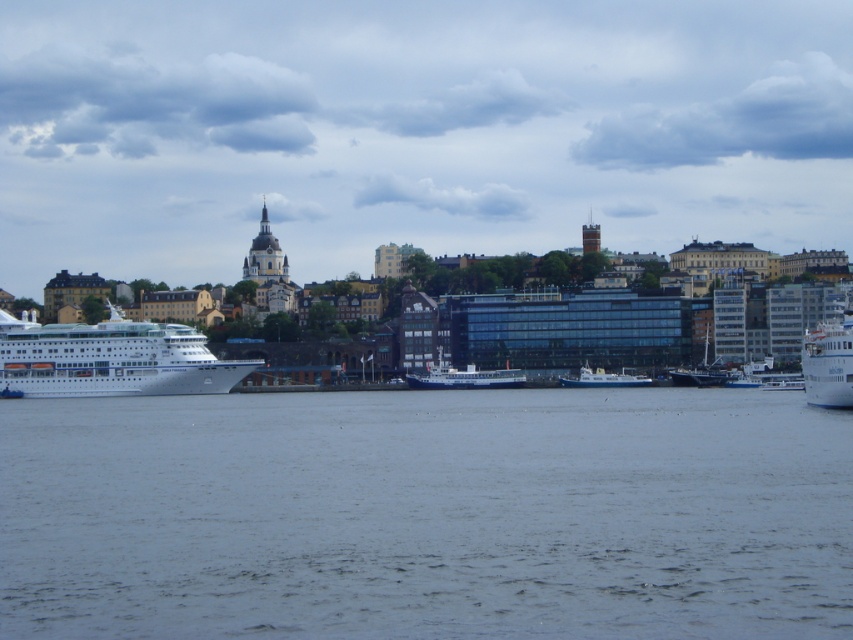
You are standing at the camera position and want to know how far the point marked at coordinates (706, 342) is from you. Can you determine the distance?

The point marked at coordinates (706, 342) is 186.01 meters away from the camera.

You are a dock worker who needs to park two boats side by side on a pier that can only accommodate a total width of 10 meters. The blue metallic boat at center and the white matte boat at center are both available. Given their widths, can both boats fit on the pier together?

The blue metallic boat at center has a lesser width compared to the white matte boat at center. If the combined width of both boats is less than or equal to 10 meters, they can fit. However, without knowing the exact widths, we cannot confirm. But since the blue metallic boat is narrower, it might allow for a better fit if arranged properly.

You are a delivery drone that needs to fly between the blue metallic boat at center and the white matte boat at center. What is the minimum distance you need to cover to travel between them?

The blue metallic boat at center and white matte boat at center are 6.45 meters apart from each other, so the minimum distance you need to cover is 6.45 meters.